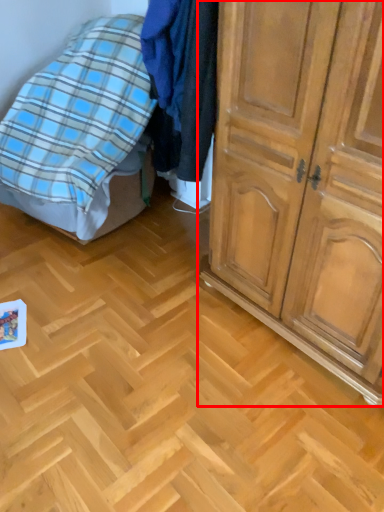
Question: From the image's perspective, where is cupboard (annotated by the red box) located relative to bed?

Choices:
 (A) below
 (B) above

Answer: (A)